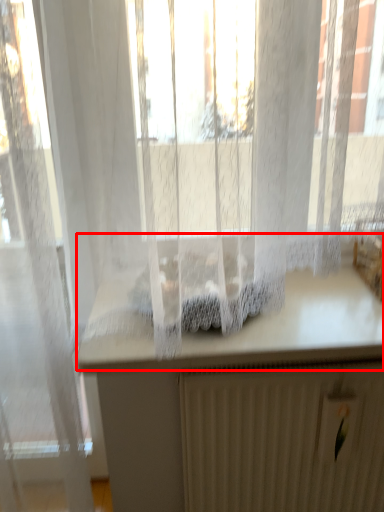
Question: In this image, where is counter top (annotated by the red box) located relative to radiator?

Choices:
 (A) left
 (B) right

Answer: (A)